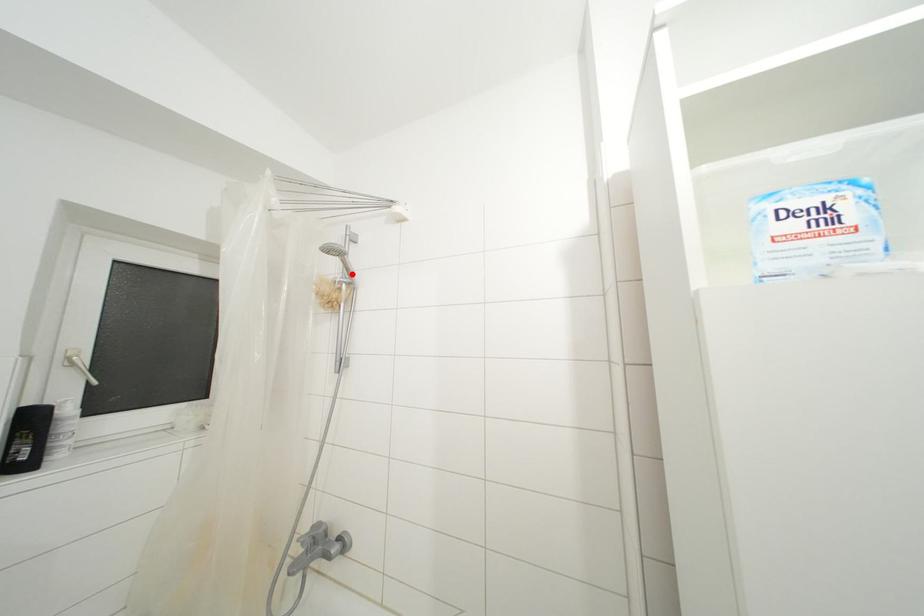
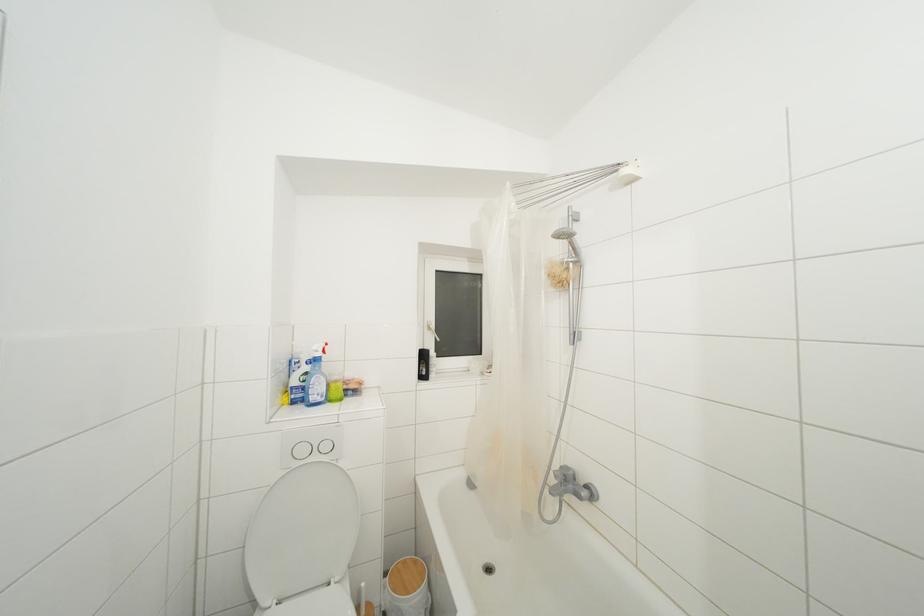
In the second image, find the point that corresponds to the highlighted location in the first image.

(578, 254)